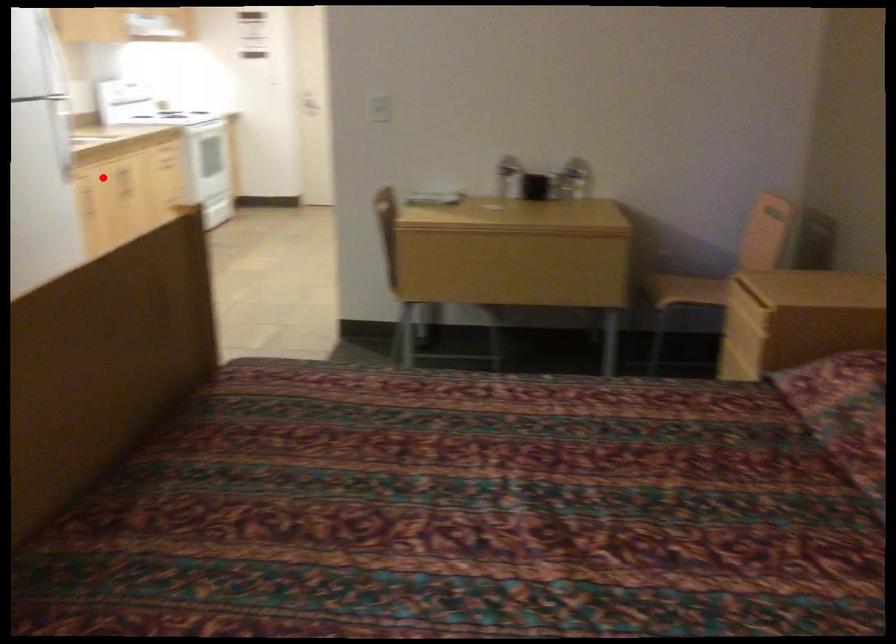
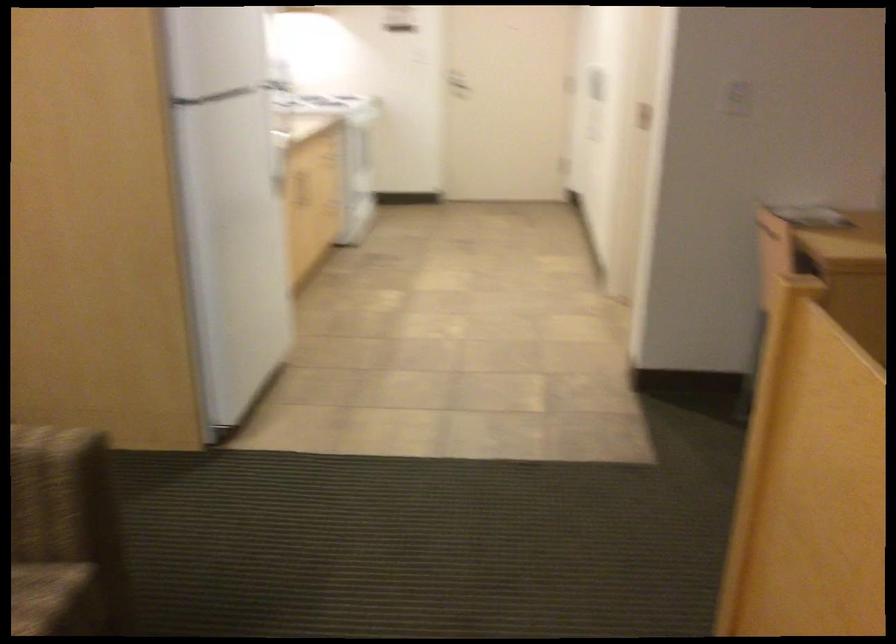
Question: I am providing you with two images of the same scene from different viewpoints. Image1 has a red point marked. In image2, the corresponding 3D location appears at what relative position? Reply with the corresponding letter.

Choices:
 (A) Closer
 (B) Farther

Answer: (A)